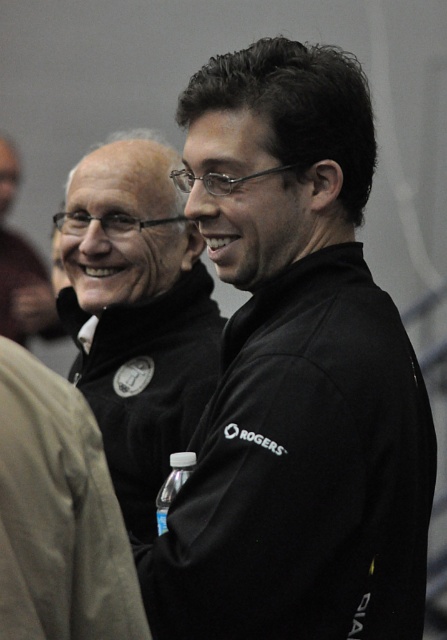
Question: Is black matte jacket at center further to the viewer compared to black fleece sweatshirt at center?

Choices:
 (A) yes
 (B) no

Answer: (A)

Question: Among these objects, which one is nearest to the camera?

Choices:
 (A) black fleece sweatshirt at center
 (B) black matte jacket at upper center
 (C) black matte jacket at center

Answer: (A)

Question: Is black fleece sweatshirt at center wider than matte black jacket at upper left?

Choices:
 (A) yes
 (B) no

Answer: (B)

Question: Is black matte jacket at upper center positioned before matte black jacket at upper left?

Choices:
 (A) no
 (B) yes

Answer: (B)

Question: Which of the following is the closest to the observer?

Choices:
 (A) (129, 211)
 (B) (350, 477)

Answer: (B)

Question: Which point is farther from the camera taking this photo?

Choices:
 (A) (81, 604)
 (B) (118, 456)

Answer: (B)